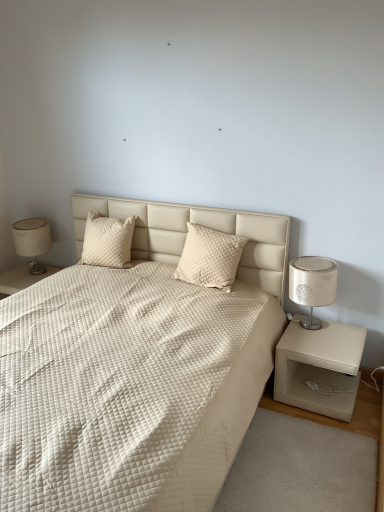
Locate an element on the screen. The image size is (384, 512). free point below matte beige lampshade at left (from a real-world perspective) is located at coordinates (38, 269).